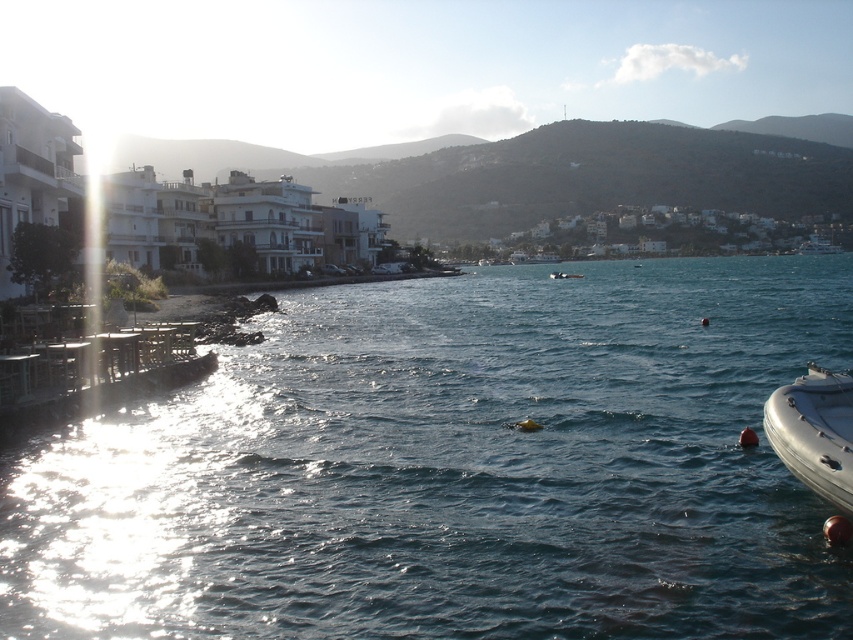
Looking at this image, you are a sailor who needs to choose between the silver metallic dinghy at lower right and the white rubber boat at center to carry 3 people. Which boat should you pick based on their sizes?

The white rubber boat at center is taller than the silver metallic dinghy at lower right, so it can accommodate more people comfortably.

You are standing on the beach and see the clear blue water at center and the white rubber boat at center. Which one appears taller from your viewpoint?

The clear blue water at center appears taller than the white rubber boat at center from your viewpoint.

You are a photographer planning to capture the silver metallic dinghy at lower right and the white rubber boat at center in a single shot. Based on their positions, which boat should you focus on first to ensure both are in frame?

The silver metallic dinghy at lower right is positioned on the left side of white rubber boat at center, so you should focus on the white rubber boat at center first to ensure both are in frame.